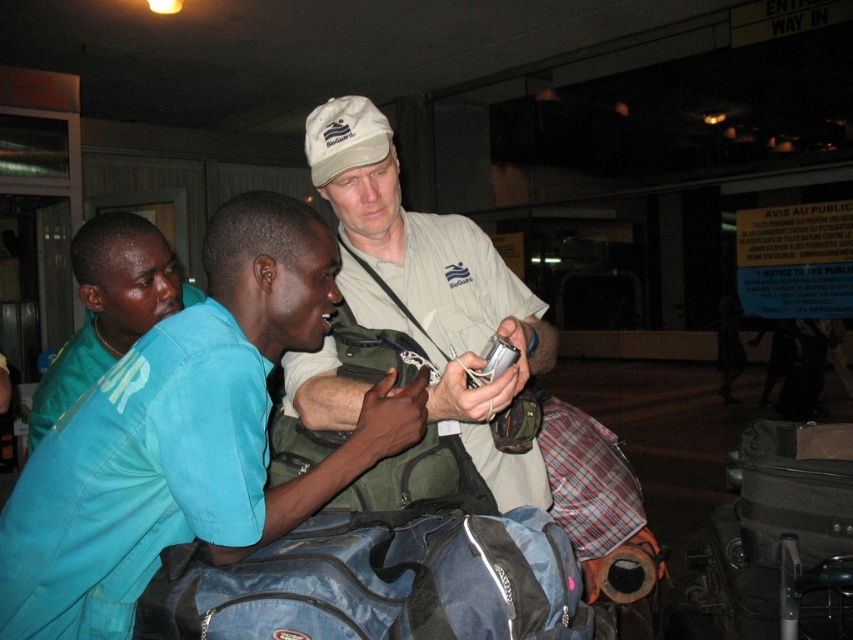
Question: Estimate the real-world distances between objects in this image. Which object is closer to the blue fabric duffel bag at center?

Choices:
 (A) light brown leather jacket at center
 (B) blue-green shirt at center

Answer: (A)

Question: Is light brown leather jacket at center further to the viewer compared to blue-green shirt at center?

Choices:
 (A) no
 (B) yes

Answer: (A)

Question: Does light brown leather jacket at center appear under blue fabric duffel bag at center?

Choices:
 (A) yes
 (B) no

Answer: (B)

Question: Is light brown leather jacket at center bigger than blue fabric duffel bag at center?

Choices:
 (A) yes
 (B) no

Answer: (A)

Question: Which point is farther from the camera taking this photo?

Choices:
 (A) (257, 406)
 (B) (447, 221)
 (C) (152, 324)

Answer: (B)

Question: Which point is farther to the camera?

Choices:
 (A) (465, 268)
 (B) (136, 240)

Answer: (B)